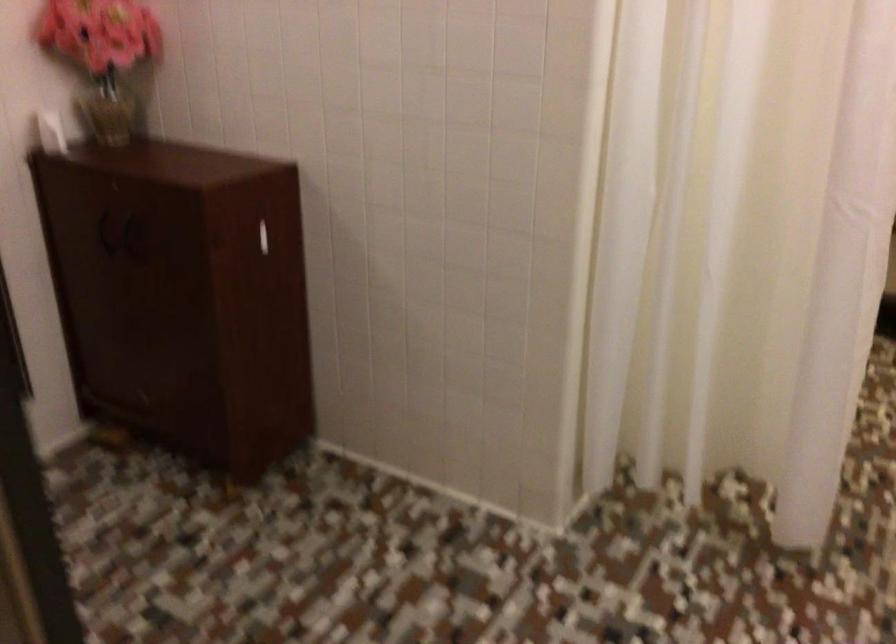
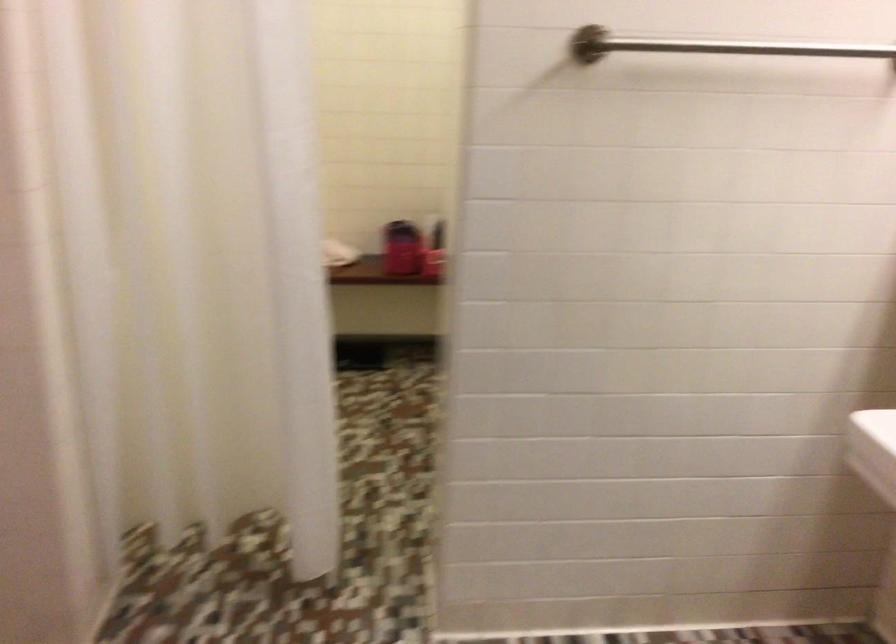
Question: The camera is either moving clockwise (left) or counter-clockwise (right) around the object. The first image is from the beginning of the video and the second image is from the end. Is the camera moving left or right when shooting the video?

Choices:
 (A) Left
 (B) Right

Answer: (A)